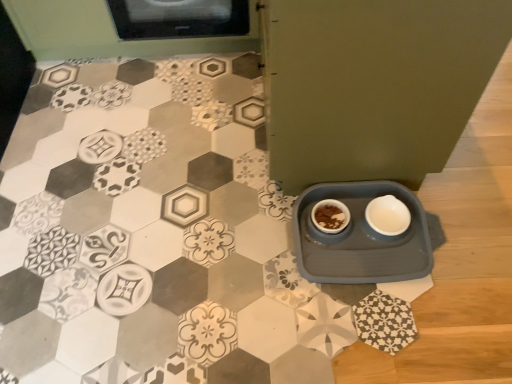
Where is `vacant space to the right of brown matte bowl at center`? vacant space to the right of brown matte bowl at center is located at coordinates (376, 207).